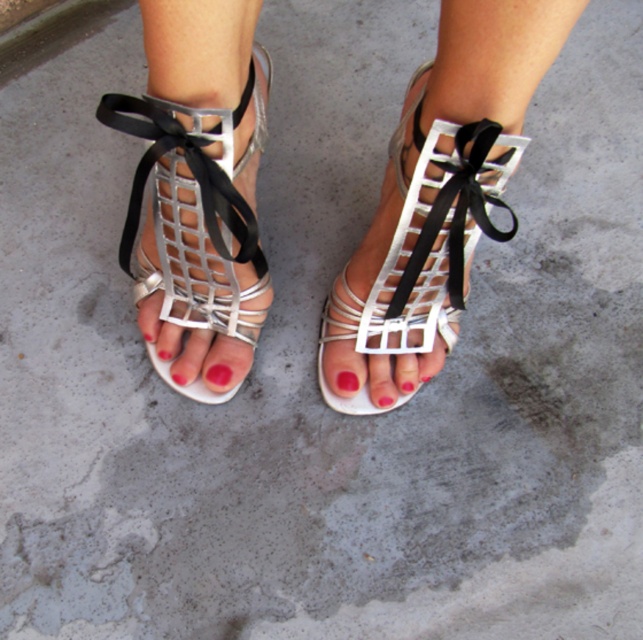
Does metallic silver sandal at center appear on the right side of matte black toe at center?

Yes, metallic silver sandal at center is to the right of matte black toe at center.

Is metallic silver sandal at center wider than matte black toe at center?

Correct, the width of metallic silver sandal at center exceeds that of matte black toe at center.

What do you see at coordinates (422, 248) in the screenshot? The width and height of the screenshot is (643, 640). I see `metallic silver sandal at center` at bounding box center [422, 248].

You are a GUI agent. You are given a task and a screenshot of the screen. Output one action in this format:
    pyautogui.click(x=<x>, y=<y>)
    Task: Click on the metallic silver sandal at center
    The height and width of the screenshot is (640, 643).
    Given the screenshot: What is the action you would take?
    pyautogui.click(x=422, y=248)

Is pink matte nail polish at center positioned in front of matte pink nail polish at center?

Yes.

Is pink matte nail polish at center wider than matte pink nail polish at center?

Yes, pink matte nail polish at center is wider than matte pink nail polish at center.

Is point (204, 381) farther from camera compared to point (349, 385)?

Yes, point (204, 381) is farther from viewer.

The height and width of the screenshot is (640, 643). In order to click on pink matte nail polish at center in this screenshot , I will do `click(217, 378)`.

Looking at this image, who is more forward, [204,346] or [156,352]?

Point [204,346]

Who is positioned more to the right, matte black toe at center or matte white nail polish at center?

matte black toe at center

Is point (174, 369) farther from viewer compared to point (170, 348)?

Yes, it is.

Locate an element on the screen. matte black toe at center is located at coordinates (186, 353).